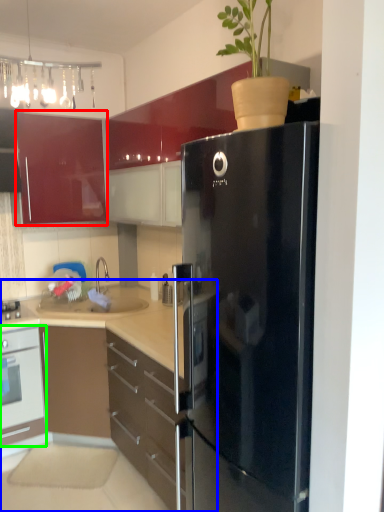
Question: Which object is the closest to the cabinetry (highlighted by a red box)? Choose among these: cabinetry (highlighted by a blue box) or oven (highlighted by a green box).

Choices:
 (A) cabinetry
 (B) oven

Answer: (B)